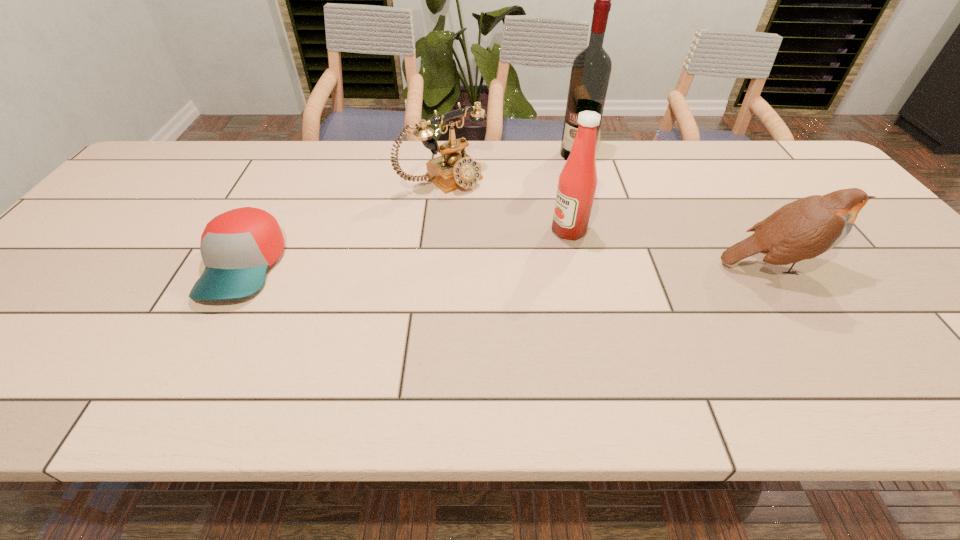
You are a GUI agent. You are given a task and a screenshot of the screen. Output one action in this format:
    pyautogui.click(x=<x>, y=<y>)
    Task: Click on the free space at the left edge of the desktop
    The height and width of the screenshot is (540, 960).
    Given the screenshot: What is the action you would take?
    pyautogui.click(x=138, y=223)

This screenshot has height=540, width=960. Find the location of `vacant space at the right edge of the desktop`. vacant space at the right edge of the desktop is located at coordinates (810, 195).

This screenshot has height=540, width=960. I want to click on free space at the near left corner of the desktop, so (x=37, y=352).

Identify the location of free space at the near right corner. The width and height of the screenshot is (960, 540). (948, 344).

Image resolution: width=960 pixels, height=540 pixels. I want to click on vacant space in between the bird and the shortest object, so click(x=508, y=266).

Locate an element on the screen. empty space between the alcohol and the telephone is located at coordinates (510, 167).

At what (x,y) coordinates should I click in order to perform the action: click on vacant region between the alcohol and the telephone. Please return your answer as a coordinate pair (x, y). Looking at the image, I should click on (510, 167).

I want to click on free point between the second tallest object and the baseball cap, so click(x=406, y=248).

At what (x,y) coordinates should I click in order to perform the action: click on vacant point located between the alcohol and the leftmost object. Please return your answer as a coordinate pair (x, y). Looking at the image, I should click on (410, 210).

In order to click on free space between the baseball cap and the bird in this screenshot , I will do `click(508, 266)`.